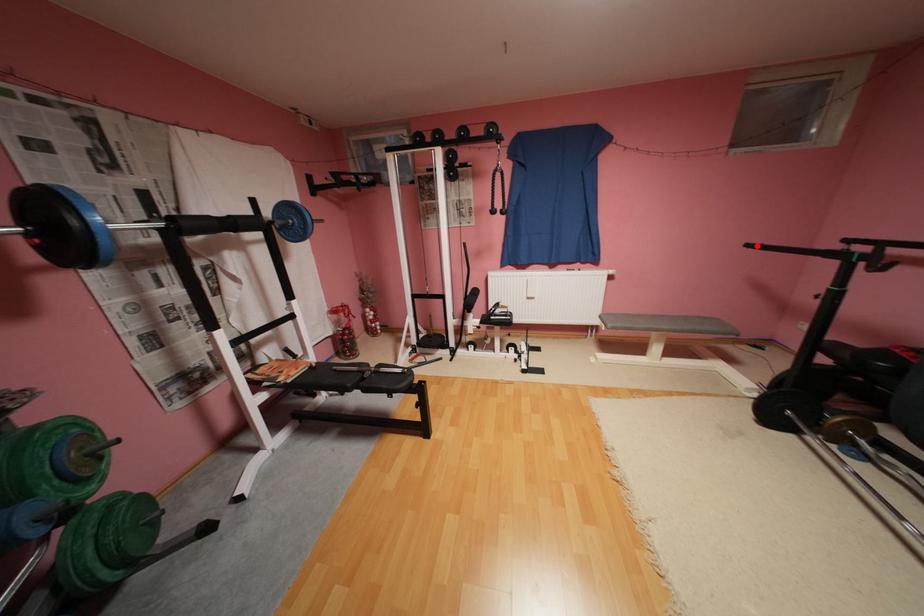
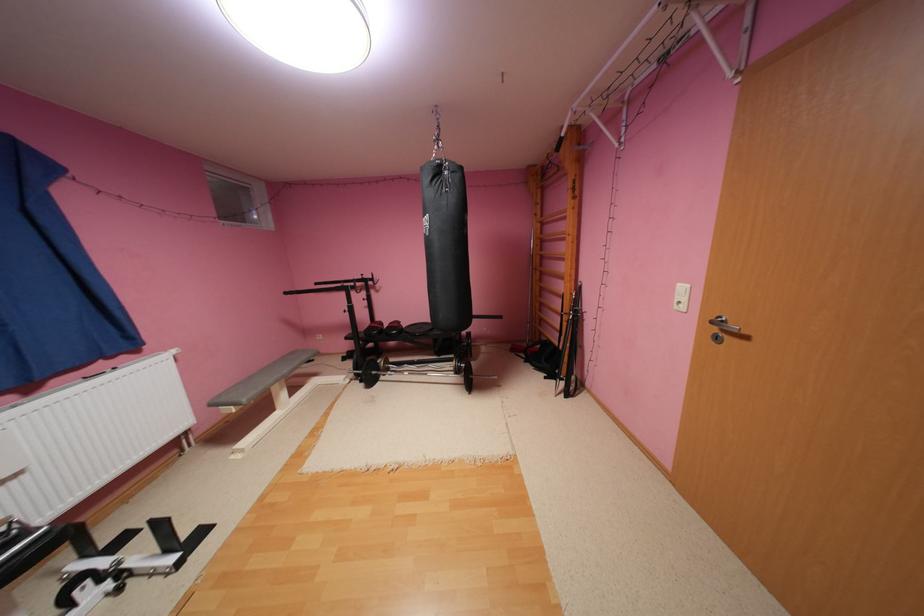
Question: I am providing you with two images of the same scene from different viewpoints. Image1 has a red point marked. In image2, the corresponding 3D location appears at what relative position? Reply with the corresponding letter.

Choices:
 (A) Closer
 (B) Farther

Answer: (A)